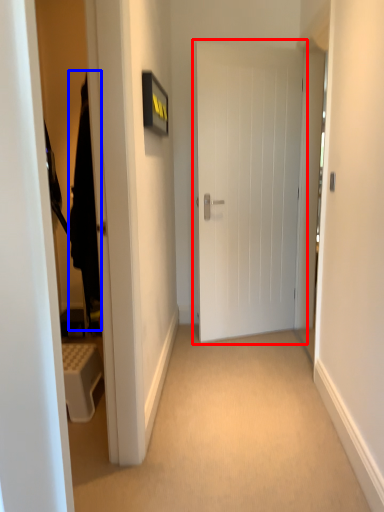
Question: Which object is closer to the camera taking this photo, door (highlighted by a red box) or robe (highlighted by a blue box)?

Choices:
 (A) door
 (B) robe

Answer: (B)